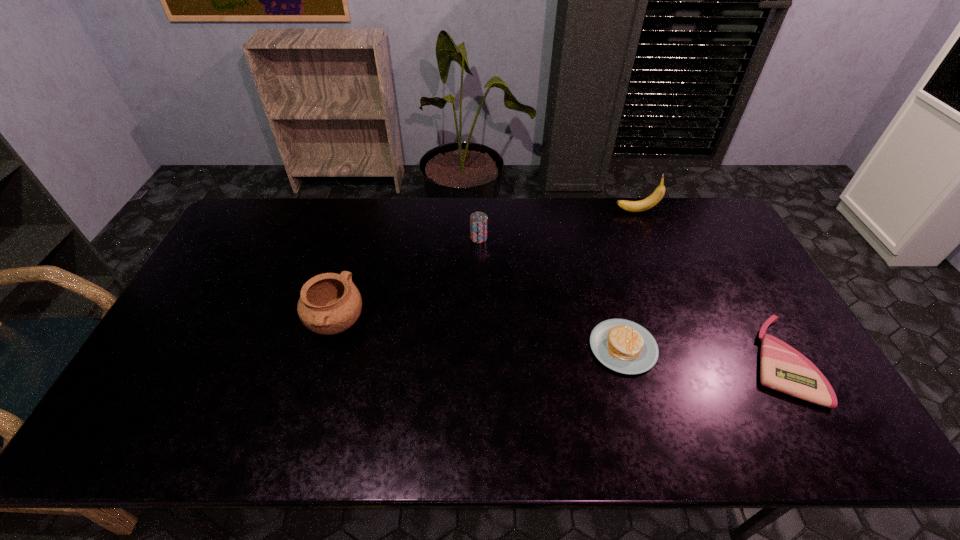
Find the location of a particular element. The width and height of the screenshot is (960, 540). blank region between the shortest object and the third tallest object is located at coordinates (628, 299).

Locate an element on the screen. This screenshot has width=960, height=540. free space between the third shortest object and the shortest object is located at coordinates (628, 299).

Find the location of `vacant region between the pottery and the third object from right to left`. vacant region between the pottery and the third object from right to left is located at coordinates (480, 335).

This screenshot has width=960, height=540. I want to click on vacant area that lies between the banana and the beer can, so click(558, 224).

Where is `free spot between the fourth object from left to right and the second shortest object`? free spot between the fourth object from left to right and the second shortest object is located at coordinates (630, 279).

Identify the location of object that is the fourth closest to the fourth object from left to right. (329, 303).

Identify which object is located as the nearest to the second object from left to right. Please provide its 2D coordinates. Your answer should be formatted as a tuple, i.e. [(x, y)], where the tuple contains the x and y coordinates of a point satisfying the conditions above.

[(329, 303)]

Image resolution: width=960 pixels, height=540 pixels. I want to click on free point that satisfies the following two spatial constraints: 1. on the front side of the beer can; 2. on the right side of the fourth tallest object, so click(479, 347).